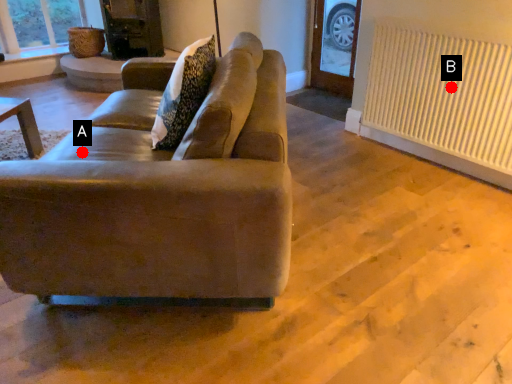
Question: Two points are circled on the image, labeled by A and B beside each circle. Which point is farther to the camera?

Choices:
 (A) A is further
 (B) B is further

Answer: (B)